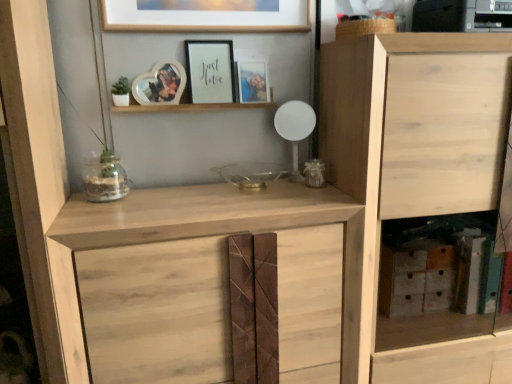
Question: From a real-world perspective, relative to natural wood cupboard at center, the second cupboard positioned from the right, is matte white frame at upper center, the second picture frame when ordered from right to left, vertically above or below?

Choices:
 (A) below
 (B) above

Answer: (B)

Question: Is matte white frame at upper center, the second picture frame when ordered from right to left, in front of or behind natural wood cupboard at center, positioned as the first cupboard in left-to-right order, in the image?

Choices:
 (A) front
 (B) behind

Answer: (B)

Question: Which object is positioned farthest from the wooden heart-shaped photo frame at upper center, which ranks as the third picture frame in right-to-left order?

Choices:
 (A) natural wood cupboard at center, positioned as the first cupboard in left-to-right order
 (B) clear glass vase at center
 (C) matte wooden photo frame at upper center, acting as the 3th picture frame starting from the left
 (D) natural wood cabinet at right, the second cupboard in the left-to-right sequence
 (E) matte white frame at upper center, the second picture frame when ordered from right to left

Answer: (D)

Question: Estimate the real-world distances between objects in this image. Which object is farther from the matte wooden photo frame at upper center, acting as the 3th picture frame starting from the left?

Choices:
 (A) natural wood cupboard at center, positioned as the first cupboard in left-to-right order
 (B) matte white frame at upper center, which is counted as the 2th picture frame, starting from the left
 (C) clear glass vase at center
 (D) natural wood cabinet at right, which is the first cupboard from right to left
 (E) wooden heart-shaped photo frame at upper center, which ranks as the third picture frame in right-to-left order

Answer: (D)